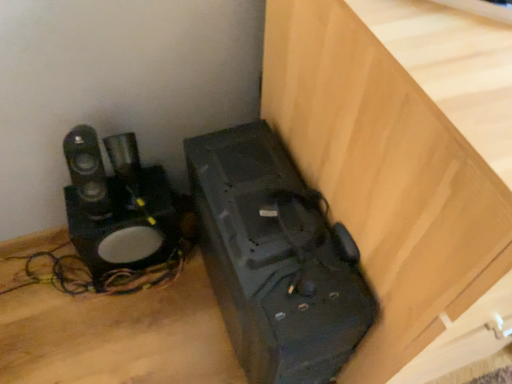
The height and width of the screenshot is (384, 512). What do you see at coordinates (389, 185) in the screenshot?
I see `black plastic speaker at lower left` at bounding box center [389, 185].

At what (x,y) coordinates should I click in order to perform the action: click on black plastic speaker at lower left. Please return your answer as a coordinate pair (x, y). This screenshot has width=512, height=384. Looking at the image, I should click on (389, 185).

Where is `matte black speaker at lower right`? matte black speaker at lower right is located at coordinates (275, 259).

Looking at this image, measure the distance between matte black speaker at lower right and camera.

The distance of matte black speaker at lower right from camera is 24.43 inches.

What do you see at coordinates (275, 259) in the screenshot? I see `matte black speaker at lower right` at bounding box center [275, 259].

You are a GUI agent. You are given a task and a screenshot of the screen. Output one action in this format:
    pyautogui.click(x=<x>, y=<y>)
    Task: Click on the black plastic speaker at lower left
    
    Given the screenshot: What is the action you would take?
    pyautogui.click(x=389, y=185)

Visually, is matte black speaker at lower right positioned to the left or to the right of black plastic speaker at lower left?

Based on their positions, matte black speaker at lower right is located to the left of black plastic speaker at lower left.

Which is behind, matte black speaker at lower right or black plastic speaker at lower left?

Positioned behind is matte black speaker at lower right.

Considering the positions of points (204, 231) and (301, 82), is point (204, 231) closer to camera compared to point (301, 82)?

No, (204, 231) is further to viewer.

From the image's perspective, which one is positioned higher, matte black speaker at lower right or black plastic speaker at lower left?

black plastic speaker at lower left appears higher in the image.

From a real-world perspective, is matte black speaker at lower right physically located above or below black plastic speaker at lower left?

In terms of real-world spatial position, matte black speaker at lower right is below black plastic speaker at lower left.

Which of these two, matte black speaker at lower right or black plastic speaker at lower left, is thinner?

matte black speaker at lower right.

Consider the image. Can you confirm if matte black speaker at lower right is shorter than black plastic speaker at lower left?

Yes, matte black speaker at lower right is shorter than black plastic speaker at lower left.

Who is bigger, matte black speaker at lower right or black plastic speaker at lower left?

black plastic speaker at lower left.

Would you say matte black speaker at lower right is inside or outside black plastic speaker at lower left?

matte black speaker at lower right cannot be found inside black plastic speaker at lower left.

Is matte black speaker at lower right not near black plastic speaker at lower left?

matte black speaker at lower right is actually quite close to black plastic speaker at lower left.

Is matte black speaker at lower right oriented away from black plastic speaker at lower left?

That's not correct — matte black speaker at lower right is not looking away from black plastic speaker at lower left.

Can you tell me how much matte black speaker at lower right and black plastic speaker at lower left differ in facing direction?

There is a 0.42-degree angle between the facing directions of matte black speaker at lower right and black plastic speaker at lower left.

Identify the location of furniture lying above the matte black speaker at lower right (from the image's perspective). The image size is (512, 384). (389, 185).

Considering the relative positions of black plastic speaker at lower left and matte black speaker at lower right in the image provided, is black plastic speaker at lower left to the right of matte black speaker at lower right from the viewer's perspective?

Indeed, black plastic speaker at lower left is positioned on the right side of matte black speaker at lower right.

Who is more distant, black plastic speaker at lower left or matte black speaker at lower right?

matte black speaker at lower right is further from the camera.

Which point is more distant from viewer, [445,128] or [343,230]?

The point [343,230] is farther from the camera.

From the picture: From the image's perspective, which one is positioned higher, black plastic speaker at lower left or matte black speaker at lower right?

black plastic speaker at lower left appears higher in the image.

From a real-world perspective, who is located lower, black plastic speaker at lower left or matte black speaker at lower right?

From a 3D spatial view, matte black speaker at lower right is below.

Which of these two, black plastic speaker at lower left or matte black speaker at lower right, is wider?

black plastic speaker at lower left is wider.

Considering the sizes of black plastic speaker at lower left and matte black speaker at lower right in the image, is black plastic speaker at lower left taller or shorter than matte black speaker at lower right?

Clearly, black plastic speaker at lower left is taller compared to matte black speaker at lower right.

Who is smaller, black plastic speaker at lower left or matte black speaker at lower right?

With smaller size is matte black speaker at lower right.

Is matte black speaker at lower right located within black plastic speaker at lower left?

No, matte black speaker at lower right is not inside black plastic speaker at lower left.

Consider the image. Is black plastic speaker at lower left next to matte black speaker at lower right and touching it?

No, black plastic speaker at lower left is not touching matte black speaker at lower right.

Is black plastic speaker at lower left oriented away from matte black speaker at lower right?

No, black plastic speaker at lower left's orientation is not away from matte black speaker at lower right.

Can you tell me how much black plastic speaker at lower left and matte black speaker at lower right differ in facing direction?

The angular difference between black plastic speaker at lower left and matte black speaker at lower right is 0.42 degrees.

How much distance is there between black plastic speaker at lower left and matte black speaker at lower right?

black plastic speaker at lower left and matte black speaker at lower right are 5.56 inches apart from each other.

Locate an element on the screen. furniture located in front of the matte black speaker at lower right is located at coordinates (389, 185).

I want to click on appliance below the black plastic speaker at lower left (from the image's perspective), so click(275, 259).

Where is `furniture that is above the matte black speaker at lower right (from the image's perspective)`? furniture that is above the matte black speaker at lower right (from the image's perspective) is located at coordinates (389, 185).